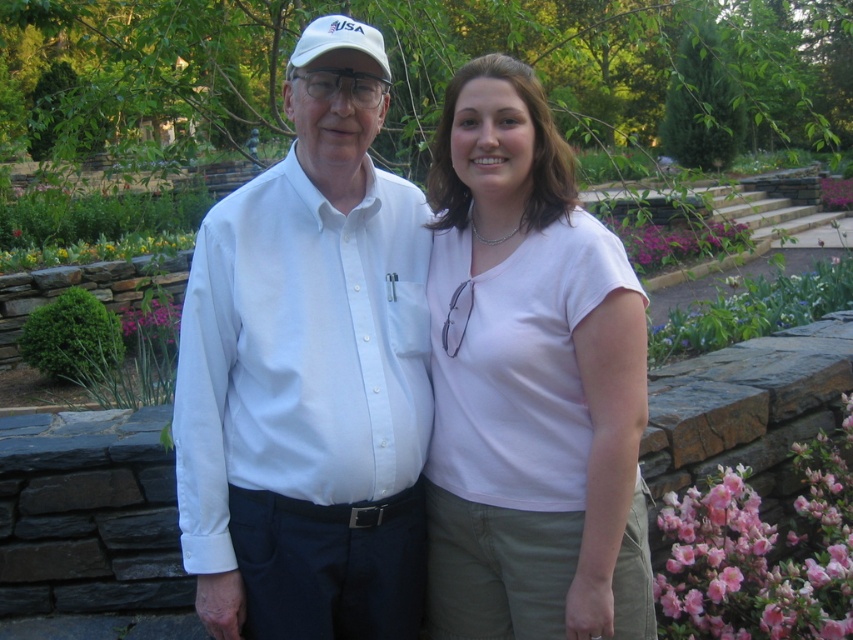
You are planning to take a photo of the two people in the garden. The photographer wants to ensure that the white smooth shirt at left is centered in the frame. Where should you position the camera relative to the point at coordinates point (308, 381)?

Result: The point (308, 381) indicates the location of the white smooth shirt at left. To center the white smooth shirt at left in the frame, the camera should be positioned directly facing this point, ensuring it is at the center of the image.

You are a photographer trying to capture a photo of the pink matte flower at lower right. You are currently standing in front of the white smooth shirt at left. Can you take a clear photo of the flower without moving your position?

The white smooth shirt at left is closer to the viewer than the pink matte flower at lower right. Since the shirt is blocking the direct line of sight to the flower, you cannot take a clear photo of the pink matte flower at lower right without moving your position.